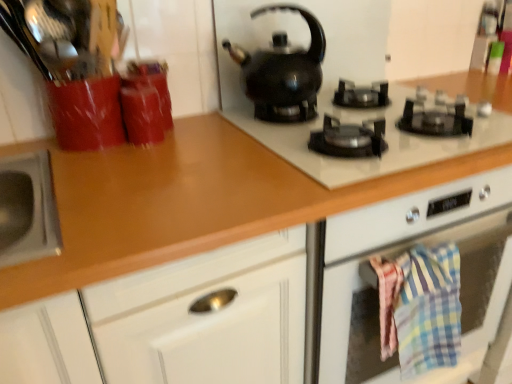
Question: Looking at the image, does black glossy kettle at upper center seem bigger or smaller compared to brown glossy countertop at center?

Choices:
 (A) big
 (B) small

Answer: (B)

Question: Is point (273, 69) positioned closer to the camera than point (220, 244)?

Choices:
 (A) farther
 (B) closer

Answer: (A)

Question: Which of these objects is positioned farthest from the plaid cotton towel at lower right?

Choices:
 (A) black glossy gas stove at upper center
 (B) brown glossy countertop at center
 (C) black glossy kettle at upper center

Answer: (C)

Question: Which of these objects is positioned farthest from the brown glossy countertop at center?

Choices:
 (A) black glossy kettle at upper center
 (B) black glossy gas stove at upper center
 (C) plaid cotton towel at lower right

Answer: (C)